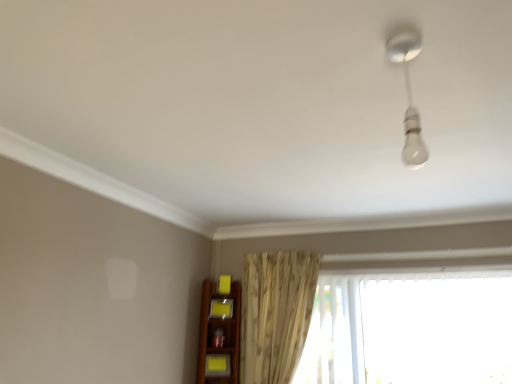
Question: Is the position of white glossy bulb at upper right less distant than that of yellow matte shelf at lower center, the 2th shelf in the bottom-to-top sequence?

Choices:
 (A) yes
 (B) no

Answer: (A)

Question: Is white glossy bulb at upper right facing towards yellow matte shelf at lower center, which ranks as the 2th shelf in front-to-back order?

Choices:
 (A) no
 (B) yes

Answer: (A)

Question: Considering the relative sizes of white glossy bulb at upper right and yellow matte shelf at lower center, which appears as the first shelf when viewed from the back, in the image provided, is white glossy bulb at upper right bigger than yellow matte shelf at lower center, which appears as the first shelf when viewed from the back,?

Choices:
 (A) no
 (B) yes

Answer: (B)

Question: Considering the relative sizes of white glossy bulb at upper right and yellow matte shelf at lower center, which appears as the first shelf when viewed from the back, in the image provided, is white glossy bulb at upper right taller than yellow matte shelf at lower center, which appears as the first shelf when viewed from the back,?

Choices:
 (A) yes
 (B) no

Answer: (A)

Question: Is white glossy bulb at upper right further to the viewer compared to yellow matte shelf at lower center, acting as the first shelf starting from the top?

Choices:
 (A) yes
 (B) no

Answer: (B)

Question: From a real-world perspective, is white glossy bulb at upper right on yellow matte shelf at lower center, which appears as the first shelf when viewed from the back?

Choices:
 (A) yes
 (B) no

Answer: (A)

Question: Does matte yellow shelf at lower center, which is the first shelf in front-to-back order, turn towards yellow matte shelf at lower center, which ranks as the 2th shelf in front-to-back order?

Choices:
 (A) yes
 (B) no

Answer: (B)

Question: From the image's perspective, is matte yellow shelf at lower center, which is the first shelf in front-to-back order, over yellow matte shelf at lower center, acting as the first shelf starting from the top?

Choices:
 (A) no
 (B) yes

Answer: (A)

Question: Is matte yellow shelf at lower center, the second shelf positioned from the top, directly adjacent to yellow matte shelf at lower center, which ranks as the 2th shelf in front-to-back order?

Choices:
 (A) no
 (B) yes

Answer: (A)

Question: From the image's perspective, would you say matte yellow shelf at lower center, which is the first shelf in front-to-back order, is shown under yellow matte shelf at lower center, the 2th shelf in the bottom-to-top sequence?

Choices:
 (A) yes
 (B) no

Answer: (A)

Question: Could yellow matte shelf at lower center, the 2th shelf in the bottom-to-top sequence, be considered to be inside matte yellow shelf at lower center, which is the first shelf in front-to-back order?

Choices:
 (A) yes
 (B) no

Answer: (B)

Question: From a real-world perspective, is matte yellow shelf at lower center, the 1th shelf from the bottom, below yellow matte shelf at lower center, the 2th shelf in the bottom-to-top sequence?

Choices:
 (A) no
 (B) yes

Answer: (B)

Question: Can you confirm if yellow matte shelf at lower center, which appears as the first shelf when viewed from the back, is taller than transparent plastic window at lower right?

Choices:
 (A) no
 (B) yes

Answer: (A)